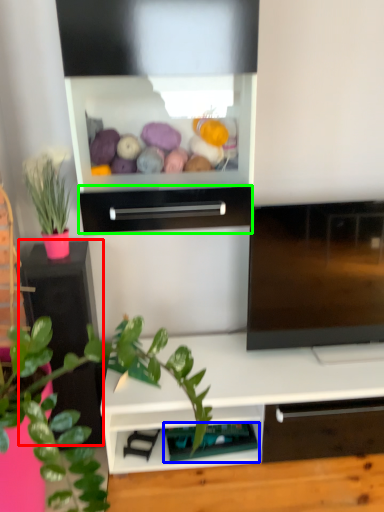
Question: Which object is the farthest from table (highlighted by a red box)? Choose among these: shelf (highlighted by a blue box) or drawer (highlighted by a green box).

Choices:
 (A) shelf
 (B) drawer

Answer: (A)